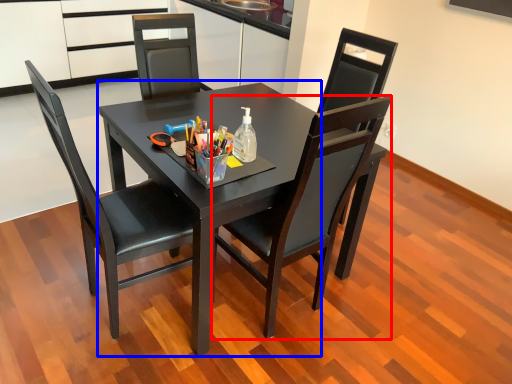
Question: Which object appears closest to the camera in this image, chair (highlighted by a red box) or round table (highlighted by a blue box)?

Choices:
 (A) chair
 (B) round table

Answer: (A)